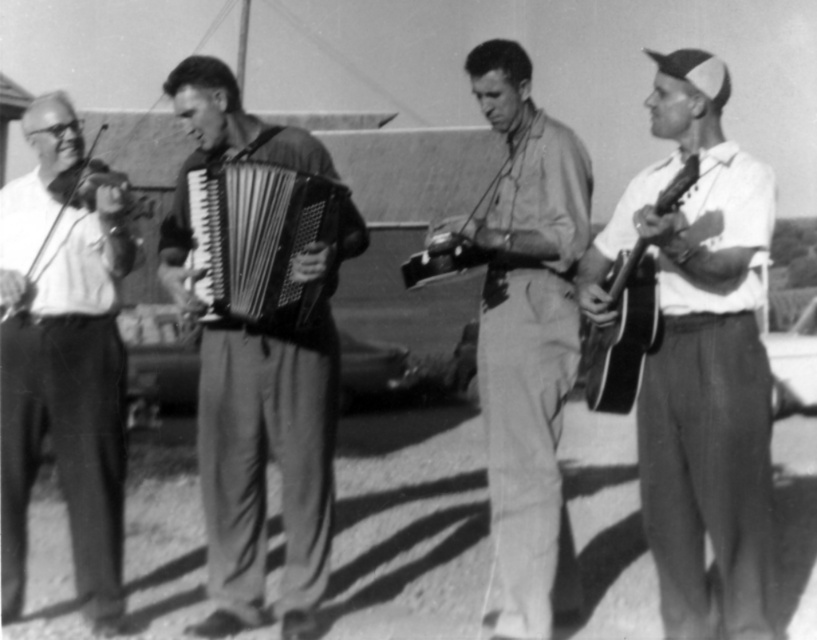
Question: Which object appears farthest from the camera in this image?

Choices:
 (A) smooth wood violin at left
 (B) white matte guitar at right
 (C) smooth black accordion at center
 (D) wooden acoustic guitar at right

Answer: (A)

Question: Which point appears closest to the camera in this image?

Choices:
 (A) (565, 595)
 (B) (224, 417)
 (C) (18, 230)
 (D) (324, 220)

Answer: (D)

Question: Does smooth wood violin at left come in front of light brown fabric shirt at center?

Choices:
 (A) yes
 (B) no

Answer: (B)

Question: Which point is closer to the camera taking this photo?

Choices:
 (A) (222, 131)
 (B) (648, 497)
 (C) (337, 205)

Answer: (B)

Question: Is light brown fabric shirt at center to the left of metallic accordion at center from the viewer's perspective?

Choices:
 (A) yes
 (B) no

Answer: (B)

Question: Does smooth wood violin at left have a greater width compared to wooden acoustic guitar at right?

Choices:
 (A) yes
 (B) no

Answer: (A)